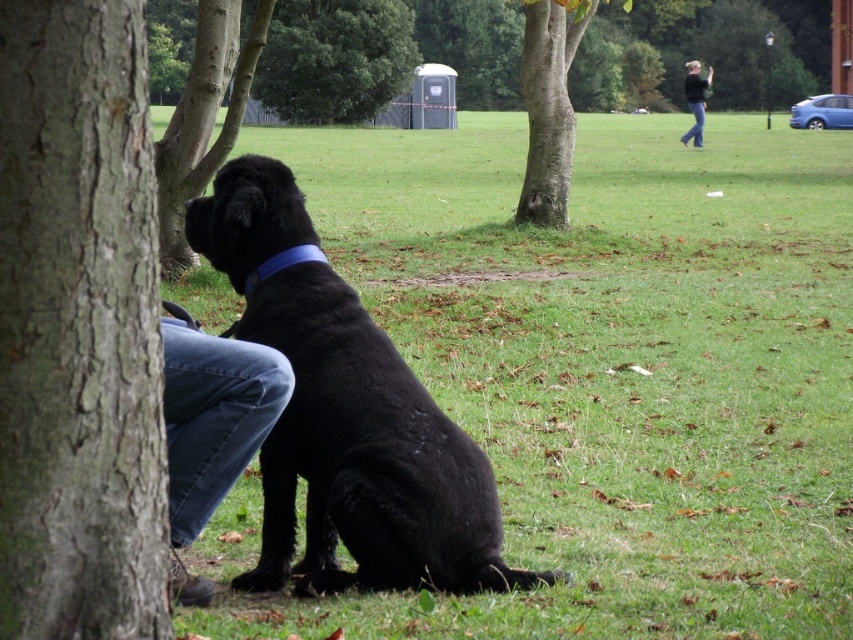
Question: Which of the following is the closest to the observer?

Choices:
 (A) (216, 54)
 (B) (770, 486)
 (C) (517, 584)

Answer: (C)

Question: Which of these objects is positioned farthest from the green grass at lower center?

Choices:
 (A) jeans at lower left
 (B) smooth bark tree at left

Answer: (B)

Question: Is brown rough tree trunk at left thinner than black fabric jacket at upper right?

Choices:
 (A) yes
 (B) no

Answer: (B)

Question: Is smooth bark tree at left behind smooth bark tree at center?

Choices:
 (A) yes
 (B) no

Answer: (B)

Question: Which point is farther to the camera?

Choices:
 (A) (231, 368)
 (B) (247, 288)

Answer: (B)

Question: Is smooth bark tree at left wider than black matte dog at lower left?

Choices:
 (A) no
 (B) yes

Answer: (A)